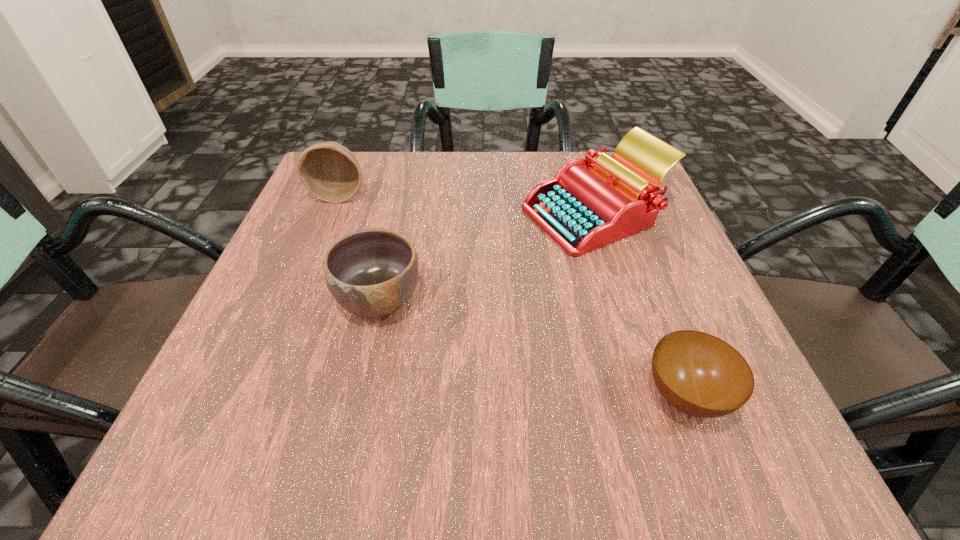
Find the location of a particular element. This screenshot has height=540, width=960. free space between the typewriter and the leftmost object is located at coordinates (468, 205).

At what (x,y) coordinates should I click in order to perform the action: click on vacant area between the rightmost bowl and the second shortest bowl. Please return your answer as a coordinate pair (x, y). This screenshot has height=540, width=960. Looking at the image, I should click on (533, 348).

This screenshot has height=540, width=960. What are the coordinates of `the closest object to the second nearest bowl` in the screenshot? It's located at (589, 203).

This screenshot has width=960, height=540. I want to click on object that is the closest to the tallest bowl, so click(x=371, y=273).

Find the location of a particular element. The image size is (960, 540). bowl that stands as the closest to the farthest bowl is located at coordinates (371, 273).

Locate an element on the screen. The width and height of the screenshot is (960, 540). bowl that stands as the closest to the leftmost bowl is located at coordinates (371, 273).

Locate an element on the screen. The image size is (960, 540). free spot that satisfies the following two spatial constraints: 1. on the typing side of the nearest object; 2. on the left side of the typewriter is located at coordinates (651, 396).

I want to click on vacant region that satisfies the following two spatial constraints: 1. on the front side of the second object from left to right; 2. on the right side of the tallest bowl, so click(297, 300).

At what (x,y) coordinates should I click in order to perform the action: click on free space that satisfies the following two spatial constraints: 1. on the typing side of the typewriter; 2. on the right side of the nearest bowl. Please return your answer as a coordinate pair (x, y). Looking at the image, I should click on (651, 396).

The width and height of the screenshot is (960, 540). I want to click on free space that satisfies the following two spatial constraints: 1. on the back side of the shortest bowl; 2. on the typing side of the typewriter, so pos(617,215).